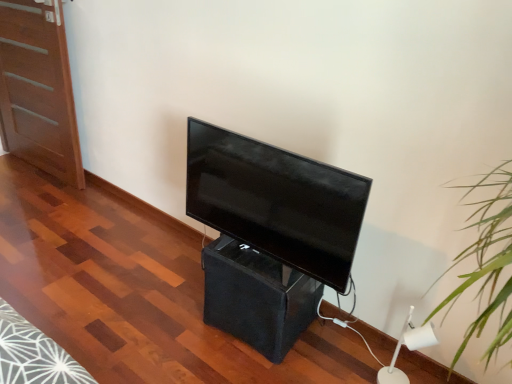
Question: Is matte black tv at center in contact with black fabric speaker at center?

Choices:
 (A) no
 (B) yes

Answer: (A)

Question: Is matte black tv at center facing towards black fabric speaker at center?

Choices:
 (A) yes
 (B) no

Answer: (B)

Question: Considering the relative sizes of matte black tv at center and black fabric speaker at center in the image provided, is matte black tv at center smaller than black fabric speaker at center?

Choices:
 (A) yes
 (B) no

Answer: (A)

Question: Is matte black tv at center bigger than black fabric speaker at center?

Choices:
 (A) yes
 (B) no

Answer: (B)

Question: From the image's perspective, is matte black tv at center under black fabric speaker at center?

Choices:
 (A) no
 (B) yes

Answer: (A)

Question: Is matte wood door at left wider or thinner than black fabric speaker at center?

Choices:
 (A) wide
 (B) thin

Answer: (B)

Question: From a real-world perspective, relative to black fabric speaker at center, is matte wood door at left vertically above or below?

Choices:
 (A) above
 (B) below

Answer: (A)

Question: Based on their positions, is matte wood door at left located to the left or right of black fabric speaker at center?

Choices:
 (A) right
 (B) left

Answer: (B)

Question: Considering their positions, is matte wood door at left located in front of or behind black fabric speaker at center?

Choices:
 (A) behind
 (B) front

Answer: (A)

Question: From a real-world perspective, is matte wood door at left above or below matte black tv at center?

Choices:
 (A) below
 (B) above

Answer: (A)

Question: Is point (72, 137) positioned closer to the camera than point (330, 165)?

Choices:
 (A) farther
 (B) closer

Answer: (A)

Question: Considering the positions of matte wood door at left and matte black tv at center in the image, is matte wood door at left wider or thinner than matte black tv at center?

Choices:
 (A) wide
 (B) thin

Answer: (B)

Question: From the image's perspective, is matte wood door at left positioned above or below matte black tv at center?

Choices:
 (A) below
 (B) above

Answer: (B)

Question: From a real-world perspective, is white plastic lamp at lower right above or below black fabric speaker at center?

Choices:
 (A) below
 (B) above

Answer: (A)

Question: Relative to black fabric speaker at center, is white plastic lamp at lower right in front or behind?

Choices:
 (A) behind
 (B) front

Answer: (B)